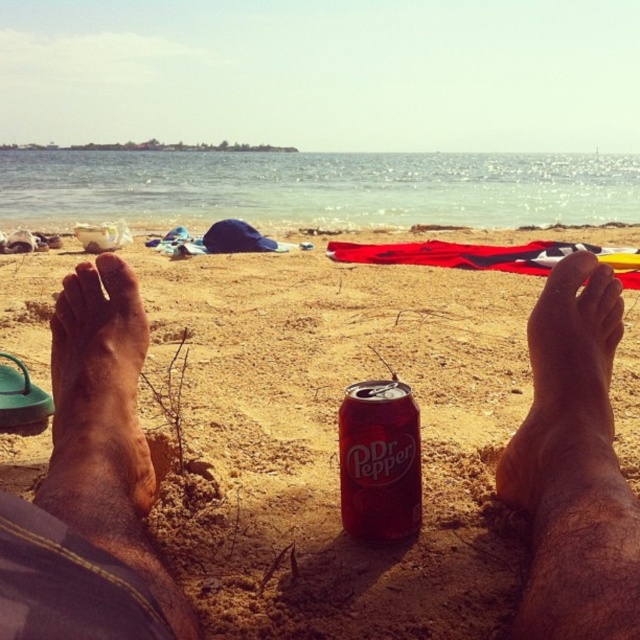
Does dry skin foot at lower right appear under brown skin at center?

No.

Which is in front, point (612, 419) or point (68, 369)?

Positioned in front is point (612, 419).

The image size is (640, 640). Find the location of `dry skin foot at lower right`. dry skin foot at lower right is located at coordinates (568, 397).

Consider the image. Between brown skin at center and glossy aluminum can at center, which one is positioned lower?

glossy aluminum can at center is below.

Does brown skin at center appear under glossy aluminum can at center?

Actually, brown skin at center is above glossy aluminum can at center.

Which is behind, point (116, 420) or point (346, 472)?

The point (346, 472) is behind.

Locate an element on the screen. The width and height of the screenshot is (640, 640). brown skin at center is located at coordinates (97, 397).

Can you confirm if smooth sand at feet center is positioned to the left of brown skin at center?

No, smooth sand at feet center is not to the left of brown skin at center.

Is smooth sand at feet center positioned behind brown skin at center?

That is False.

Is point (547, 572) in front of point (92, 272)?

Yes, point (547, 572) is in front of point (92, 272).

You are a GUI agent. You are given a task and a screenshot of the screen. Output one action in this format:
    pyautogui.click(x=<x>, y=<y>)
    Task: Click on the smooth sand at feet center
    The height and width of the screenshot is (640, 640).
    Given the screenshot: What is the action you would take?
    pyautogui.click(x=92, y=484)